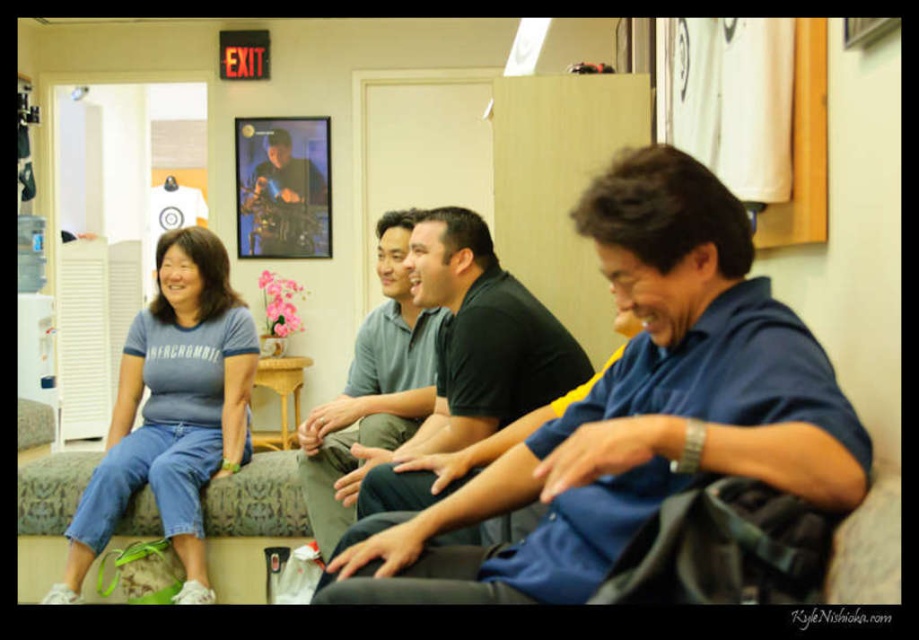
You are an interior designer analyzing the layout of this room. You need to place a new lamp that will illuminate the area where the blue cotton shirt at left is located. What coordinates should the lamp be placed to best illuminate that spot?

The lamp should be placed at coordinates approximately near the blue cotton shirt at left, specifically around the point given in the description, which is at 2D location point (x=172, y=410).

You are trying to find the dark green polo shirt at center in the image. Where would you look relative to the denim couch at center?

The dark green polo shirt at center is positioned over the denim couch at center, so you should look directly on top of the denim couch at center to find it.

You are a delivery person who needs to place a small package between the dark green polo shirt at center and the denim couch at center. The package is 40 inches long. Will it fit in the space between them?

The distance between the dark green polo shirt at center and the denim couch at center is 39.07 inches. Since the package is 40 inches long, it will not fit in the space between them.